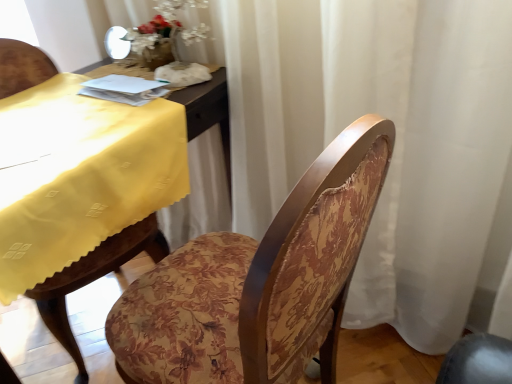
Question: Considering the positions of floral fabric chair at center and yellow fabric table at left in the image, is floral fabric chair at center taller or shorter than yellow fabric table at left?

Choices:
 (A) tall
 (B) short

Answer: (A)

Question: Is point (242, 342) positioned closer to the camera than point (118, 266)?

Choices:
 (A) farther
 (B) closer

Answer: (B)

Question: Considering the relative positions of floral fabric chair at center and yellow fabric table at left in the image provided, is floral fabric chair at center to the left or to the right of yellow fabric table at left?

Choices:
 (A) left
 (B) right

Answer: (B)

Question: From a real-world perspective, is yellow fabric table at left positioned above or below floral fabric chair at center?

Choices:
 (A) above
 (B) below

Answer: (A)

Question: Is point (186, 110) closer or farther from the camera than point (344, 173)?

Choices:
 (A) closer
 (B) farther

Answer: (B)

Question: Based on their sizes in the image, would you say yellow fabric table at left is bigger or smaller than floral fabric chair at center?

Choices:
 (A) small
 (B) big

Answer: (A)

Question: In the image, is yellow fabric table at left positioned in front of or behind floral fabric chair at center?

Choices:
 (A) behind
 (B) front

Answer: (A)